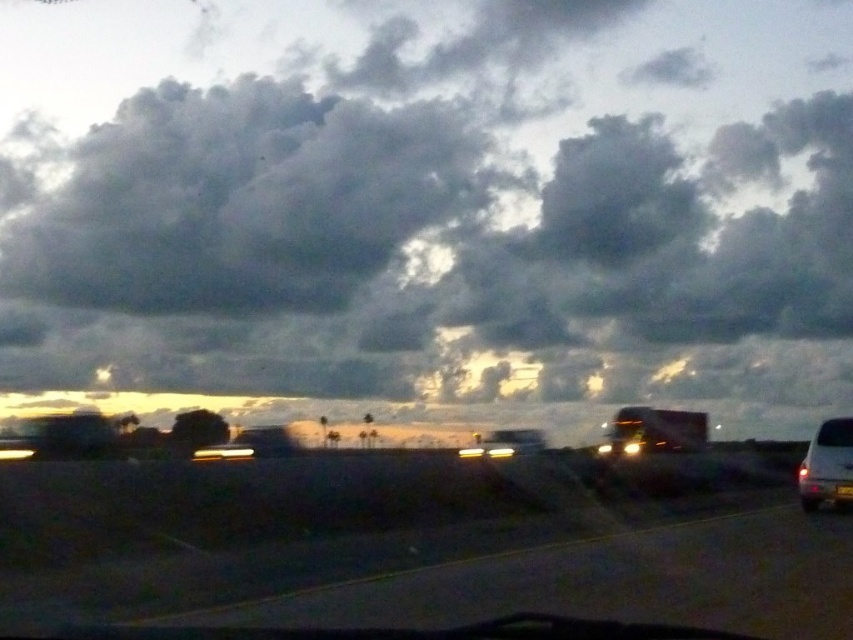
Question: Which point is closer to the camera?

Choices:
 (A) (144, 54)
 (B) (849, 483)

Answer: (B)

Question: Does dark gray cloud at upper center appear over white glossy van at lower right?

Choices:
 (A) no
 (B) yes

Answer: (B)

Question: Based on their relative distances, which object is nearer to the white glossy van at lower right?

Choices:
 (A) dark gray cloud at upper center
 (B) dark asphalt highway at center
 (C) transparent glass windshield at lower right

Answer: (C)

Question: Can you confirm if white glossy van at lower right is smaller than transparent glass windshield at lower right?

Choices:
 (A) no
 (B) yes

Answer: (A)

Question: Estimate the real-world distances between objects in this image. Which object is farther from the transparent glass windshield at lower right?

Choices:
 (A) dark gray cloud at upper center
 (B) dark asphalt highway at center
 (C) white glossy van at lower right

Answer: (A)

Question: Is dark gray cloud at upper center further to the viewer compared to transparent glass windshield at lower right?

Choices:
 (A) yes
 (B) no

Answer: (A)